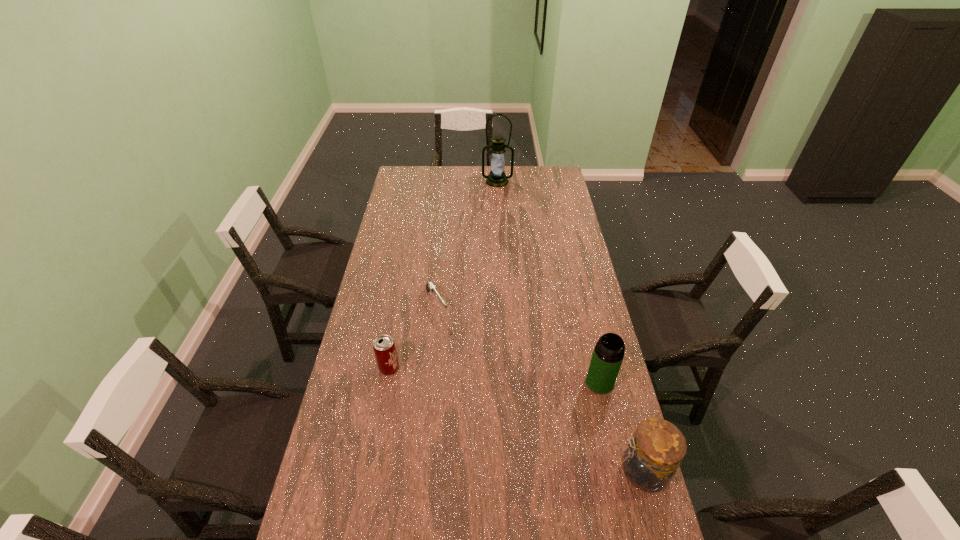
Where is `vacant space on the desktop that is between the beer can and the third tallest object and is positioned from the spout of the second tallest object`? The height and width of the screenshot is (540, 960). vacant space on the desktop that is between the beer can and the third tallest object and is positioned from the spout of the second tallest object is located at coordinates (495, 411).

The width and height of the screenshot is (960, 540). I want to click on vacant spot on the desktop that is between the leftmost object and the jar and is positioned on the front-facing side of the second object from left to right, so click(514, 419).

The width and height of the screenshot is (960, 540). I want to click on free spot on the desktop that is between the second shortest object and the jar and is positioned on the side where the tallest object emits light, so click(494, 411).